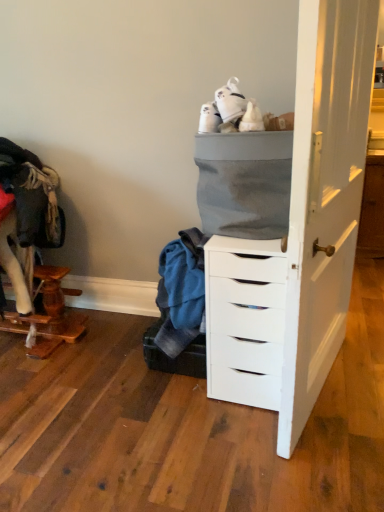
Find the location of a particular element. The image size is (384, 512). free space to the left of white matte chest of drawers at center is located at coordinates (140, 391).